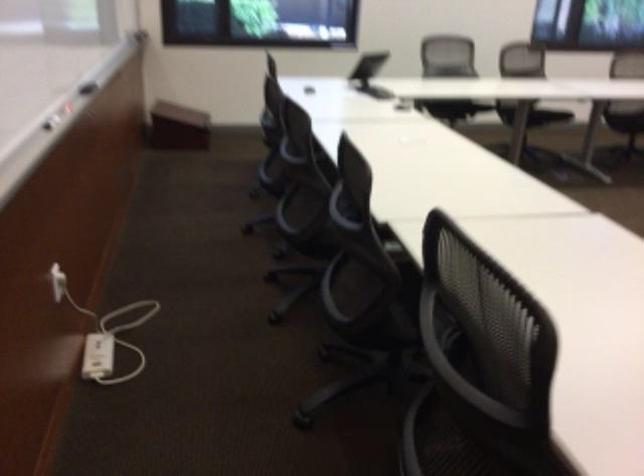
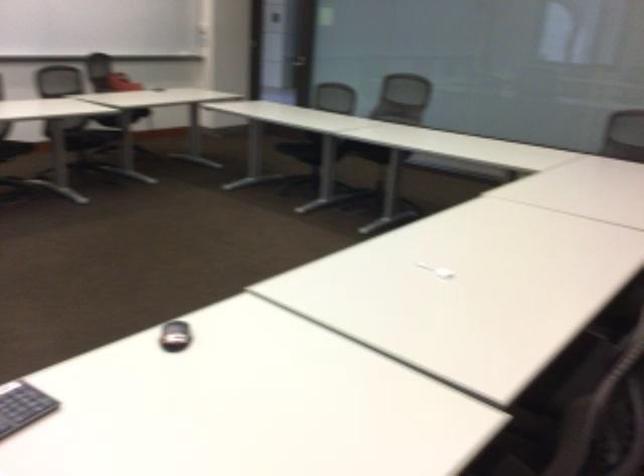
Question: The images are taken continuously from a first-person perspective. In which direction are you moving?

Choices:
 (A) Left
 (B) Right
 (C) Forward
 (D) Backward

Answer: (D)